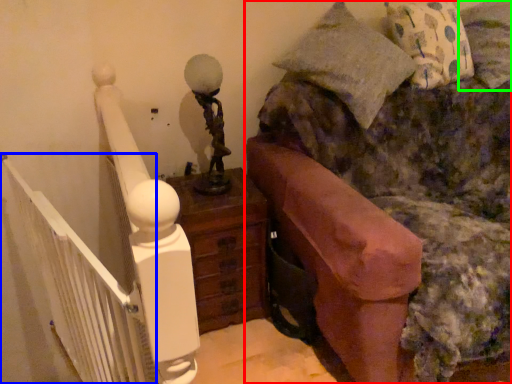
Question: Which is nearer to the furniture (highlighted by a red box)? balustrade (highlighted by a blue box) or pillow (highlighted by a green box).

Choices:
 (A) balustrade
 (B) pillow

Answer: (B)